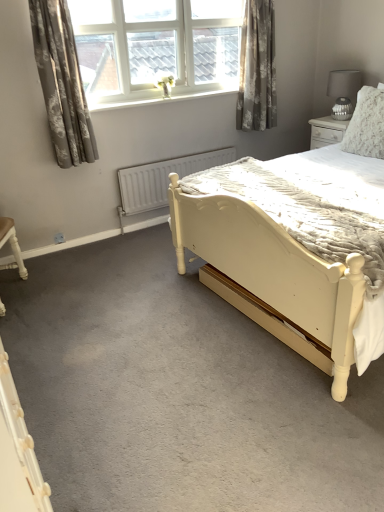
Question: Does matte gray lampshade at upper right have a larger size compared to floral gray curtain at upper left, marked as the first curtain in a left-to-right arrangement?

Choices:
 (A) no
 (B) yes

Answer: (A)

Question: Is matte gray lampshade at upper right in front of floral gray curtain at upper left, the 1th curtain when ordered from front to back?

Choices:
 (A) yes
 (B) no

Answer: (B)

Question: Is matte gray lampshade at upper right placed right next to floral gray curtain at upper left, positioned as the second curtain in right-to-left order?

Choices:
 (A) yes
 (B) no

Answer: (B)

Question: Is matte gray lampshade at upper right oriented towards floral gray curtain at upper left, the 1th curtain when ordered from front to back?

Choices:
 (A) yes
 (B) no

Answer: (A)

Question: From a real-world perspective, is matte gray lampshade at upper right under floral gray curtain at upper left, the 1th curtain when ordered from front to back?

Choices:
 (A) no
 (B) yes

Answer: (B)

Question: Based on their positions, is floral gray curtain at upper left, which appears as the second curtain when viewed from the back, located to the left or right of white glossy window sill at upper center?

Choices:
 (A) right
 (B) left

Answer: (B)

Question: Is floral gray curtain at upper left, marked as the first curtain in a left-to-right arrangement, wider or thinner than white glossy window sill at upper center?

Choices:
 (A) wide
 (B) thin

Answer: (A)

Question: Is point (48, 44) closer or farther from the camera than point (125, 101)?

Choices:
 (A) farther
 (B) closer

Answer: (B)

Question: From a real-world perspective, is floral gray curtain at upper left, the 1th curtain when ordered from front to back, above or below white glossy window sill at upper center?

Choices:
 (A) above
 (B) below

Answer: (A)

Question: Relative to matte gray lampshade at upper right, is floral fabric curtain at upper right, positioned as the first curtain in back-to-front order, in front or behind?

Choices:
 (A) behind
 (B) front

Answer: (B)

Question: Is floral fabric curtain at upper right, placed as the 2th curtain when sorted from left to right, taller or shorter than matte gray lampshade at upper right?

Choices:
 (A) short
 (B) tall

Answer: (B)

Question: Which is correct: floral fabric curtain at upper right, which is the second curtain in front-to-back order, is inside matte gray lampshade at upper right, or outside of it?

Choices:
 (A) inside
 (B) outside

Answer: (B)

Question: From the image's perspective, is floral fabric curtain at upper right, which is the second curtain in front-to-back order, located above or below matte gray lampshade at upper right?

Choices:
 (A) below
 (B) above

Answer: (B)

Question: Considering the positions of point (x=97, y=35) and point (x=347, y=92), is point (x=97, y=35) closer or farther from the camera than point (x=347, y=92)?

Choices:
 (A) farther
 (B) closer

Answer: (B)

Question: Is white plastic window at upper center bigger or smaller than matte gray lampshade at upper right?

Choices:
 (A) small
 (B) big

Answer: (B)